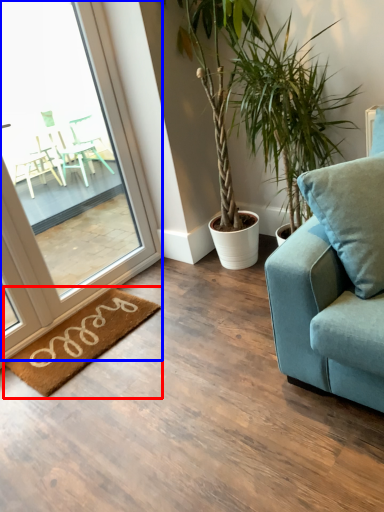
Question: Which object is further to the camera taking this photo, mat (highlighted by a red box) or window (highlighted by a blue box)?

Choices:
 (A) mat
 (B) window

Answer: (A)